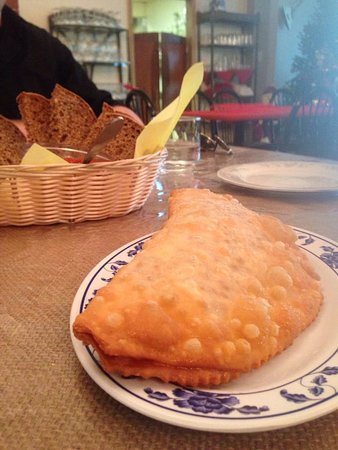
At what (x,y) coordinates should I click in order to perform the action: click on basket. Please return your answer as a coordinate pair (x, y). The image size is (338, 450). Looking at the image, I should click on (48, 190).